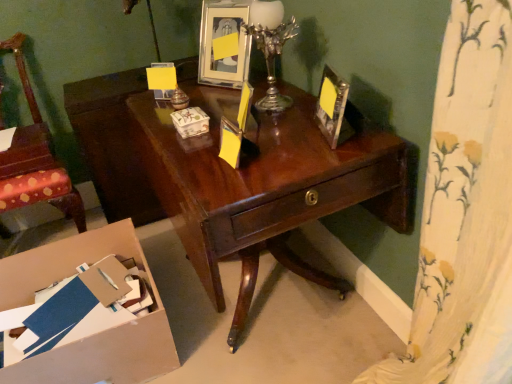
The height and width of the screenshot is (384, 512). What are the coordinates of `vacant space that's between metallic silver picture frame at upper center, positioned as the second picture frame in right-to-left order, and matte ceramic box at center` in the screenshot? It's located at (212, 102).